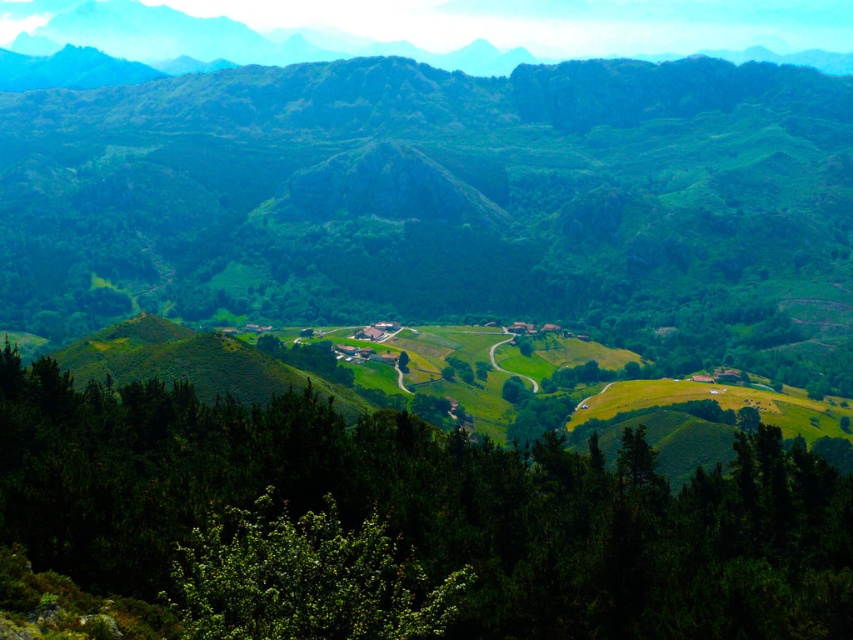
Question: Which point is closer to the camera?

Choices:
 (A) (270, 620)
 (B) (398, 364)
 (C) (326, 33)
 (D) (567, 499)

Answer: (A)

Question: Which point is farther to the camera?

Choices:
 (A) (245, 528)
 (B) (105, 44)
 (C) (402, 358)

Answer: (B)

Question: Can you confirm if green matte tree at center is smaller than green textured mountains at upper center?

Choices:
 (A) yes
 (B) no

Answer: (A)

Question: Can you confirm if green matte tree at center is positioned to the left of green leafy bush at lower center?

Choices:
 (A) no
 (B) yes

Answer: (A)

Question: Can you confirm if green matte tree at center is positioned above green textured mountains at upper center?

Choices:
 (A) no
 (B) yes

Answer: (A)

Question: Which point is closer to the camera?

Choices:
 (A) green matte tree at center
 (B) green leafy bush at lower center
 (C) green textured mountains at upper center
 (D) green leafy tree at center

Answer: (B)